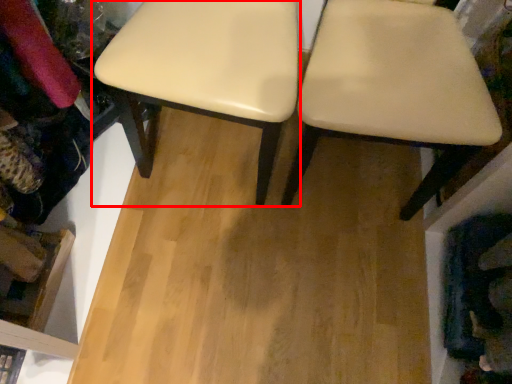
Question: From the image, what is the correct spatial relationship of stool (annotated by the red box) in relation to chair?

Choices:
 (A) right
 (B) left

Answer: (B)